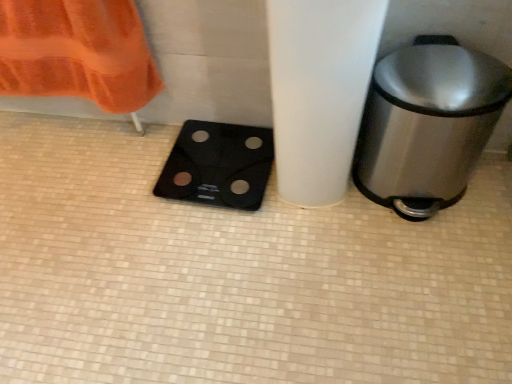
Question: Should I look upward or downward to see polished stainless steel trash can at right?

Choices:
 (A) down
 (B) up

Answer: (B)

Question: From a real-world perspective, is black glass scale at lower left under polished stainless steel trash can at right?

Choices:
 (A) yes
 (B) no

Answer: (A)

Question: From a real-world perspective, is black glass scale at lower left on polished stainless steel trash can at right?

Choices:
 (A) yes
 (B) no

Answer: (B)

Question: Does black glass scale at lower left touch polished stainless steel trash can at right?

Choices:
 (A) no
 (B) yes

Answer: (A)

Question: Is black glass scale at lower left not within polished stainless steel trash can at right?

Choices:
 (A) no
 (B) yes

Answer: (B)

Question: From the image's perspective, does black glass scale at lower left appear lower than polished stainless steel trash can at right?

Choices:
 (A) no
 (B) yes

Answer: (B)

Question: Is black glass scale at lower left in front of polished stainless steel trash can at right?

Choices:
 (A) yes
 (B) no

Answer: (B)

Question: From a real-world perspective, does polished stainless steel trash can at right sit lower than black glass scale at lower left?

Choices:
 (A) yes
 (B) no

Answer: (B)

Question: Is polished stainless steel trash can at right positioned beyond the bounds of black glass scale at lower left?

Choices:
 (A) no
 (B) yes

Answer: (B)

Question: Is black glass scale at lower left inside polished stainless steel trash can at right?

Choices:
 (A) no
 (B) yes

Answer: (A)

Question: From the image's perspective, is polished stainless steel trash can at right below black glass scale at lower left?

Choices:
 (A) no
 (B) yes

Answer: (A)

Question: Is polished stainless steel trash can at right to the right of black glass scale at lower left from the viewer's perspective?

Choices:
 (A) no
 (B) yes

Answer: (B)

Question: Can you confirm if polished stainless steel trash can at right is thinner than black glass scale at lower left?

Choices:
 (A) yes
 (B) no

Answer: (A)

Question: Considering the relative positions of polished stainless steel trash can at right and black glass scale at lower left in the image provided, is polished stainless steel trash can at right to the left or to the right of black glass scale at lower left?

Choices:
 (A) left
 (B) right

Answer: (B)